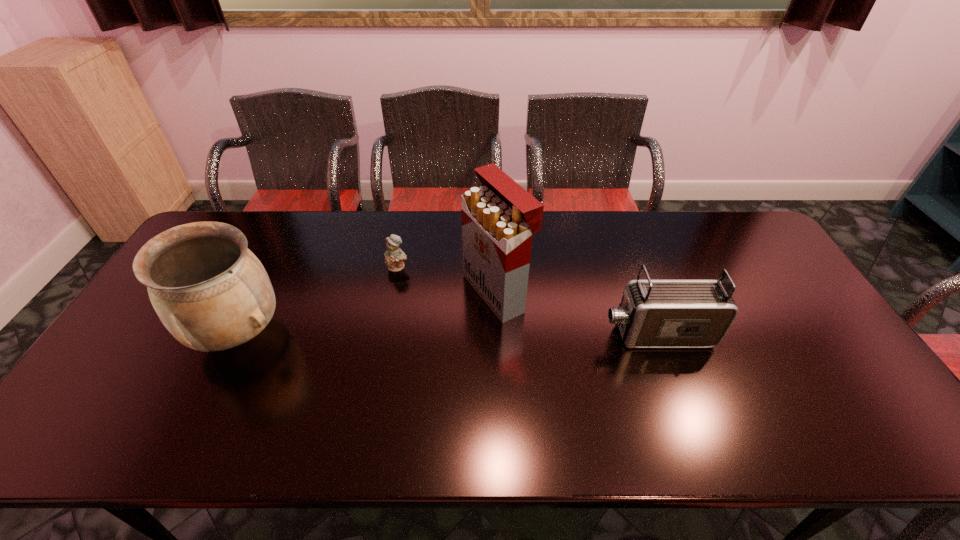
At what (x,y) coordinates should I click in order to perform the action: click on free space on the desktop that is between the second tallest object and the rightmost object and is positioned on the front-facing side of the third object from right to left. Please return your answer as a coordinate pair (x, y). This screenshot has height=540, width=960. Looking at the image, I should click on (393, 333).

The height and width of the screenshot is (540, 960). Identify the location of vacant spot on the desktop that is between the urn and the rightmost object and is positioned with the lid open on the cigarette case. (399, 333).